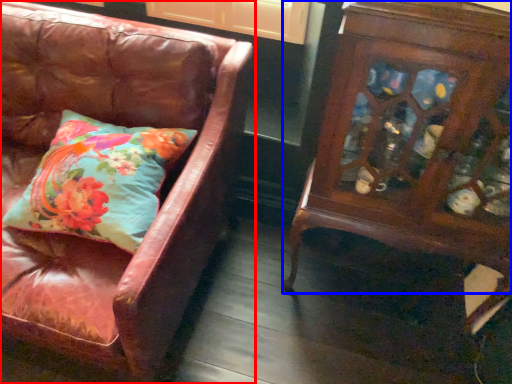
Question: Which point is further to the camera, chair (highlighted by a red box) or furniture (highlighted by a blue box)?

Choices:
 (A) chair
 (B) furniture

Answer: (B)